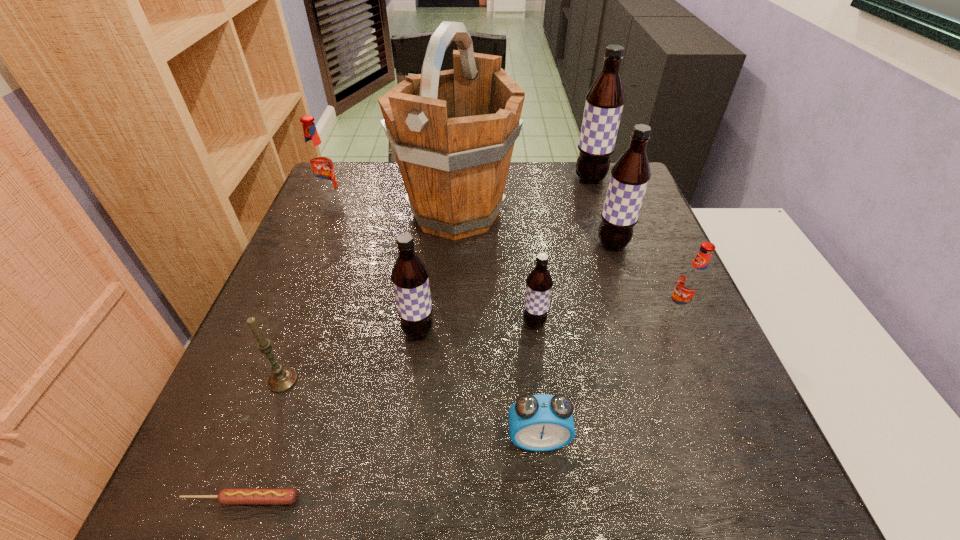
Locate an element on the screen. sausage that is at the near edge is located at coordinates (230, 496).

Where is `root beer at the left edge`? Image resolution: width=960 pixels, height=540 pixels. root beer at the left edge is located at coordinates (319, 164).

Identify the location of candle that is at the left edge. The width and height of the screenshot is (960, 540). (282, 378).

Image resolution: width=960 pixels, height=540 pixels. In order to click on sausage at the left edge in this screenshot , I will do `click(230, 496)`.

The height and width of the screenshot is (540, 960). Find the location of `object that is at the far left corner`. object that is at the far left corner is located at coordinates (319, 164).

Image resolution: width=960 pixels, height=540 pixels. I want to click on object that is at the near left corner, so click(230, 496).

Image resolution: width=960 pixels, height=540 pixels. In order to click on object situated at the far right corner in this screenshot , I will do `click(604, 104)`.

The image size is (960, 540). In the image, there is a desktop. In order to click on free space at the near edge in this screenshot , I will do `click(407, 503)`.

Identify the location of free space at the left edge of the desktop. This screenshot has height=540, width=960. (345, 272).

What are the coordinates of `free region at the right edge` in the screenshot? It's located at (673, 431).